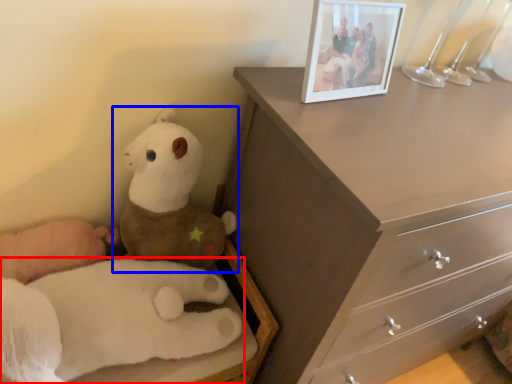
Question: Which object appears farthest to the camera in this image, toy (highlighted by a red box) or toy (highlighted by a blue box)?

Choices:
 (A) toy
 (B) toy

Answer: (B)